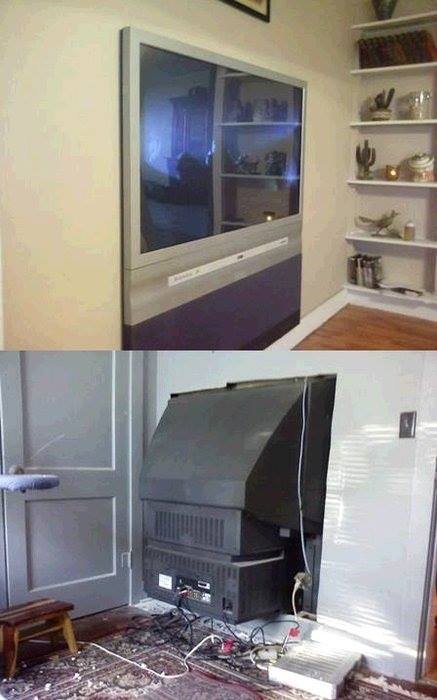
Locate an element on the screen. The height and width of the screenshot is (700, 437). tv back is located at coordinates (228, 456).